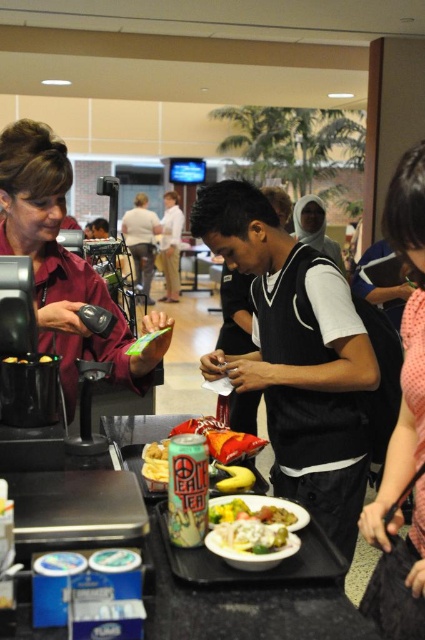
Measure the distance between pink dotted dress at right and camera.

36.21 inches

Does pink dotted dress at right have a larger size compared to yellow matte chips at center?

Correct, pink dotted dress at right is larger in size than yellow matte chips at center.

Locate an element on the screen. Image resolution: width=425 pixels, height=640 pixels. pink dotted dress at right is located at coordinates (402, 429).

Is matte maroon shirt at left closer to camera compared to yellow matte chips at center?

Yes.

What do you see at coordinates (64, 264) in the screenshot? The height and width of the screenshot is (640, 425). I see `matte maroon shirt at left` at bounding box center [64, 264].

What are the coordinates of `matte maroon shirt at left` in the screenshot? It's located at (64, 264).

The height and width of the screenshot is (640, 425). What do you see at coordinates (402, 429) in the screenshot? I see `pink dotted dress at right` at bounding box center [402, 429].

Is point (414, 170) positioned before point (255, 529)?

Yes, it is in front of point (255, 529).

The height and width of the screenshot is (640, 425). Identify the location of pink dotted dress at right. (402, 429).

Where is `pink dotted dress at right`? The height and width of the screenshot is (640, 425). pink dotted dress at right is located at coordinates (402, 429).